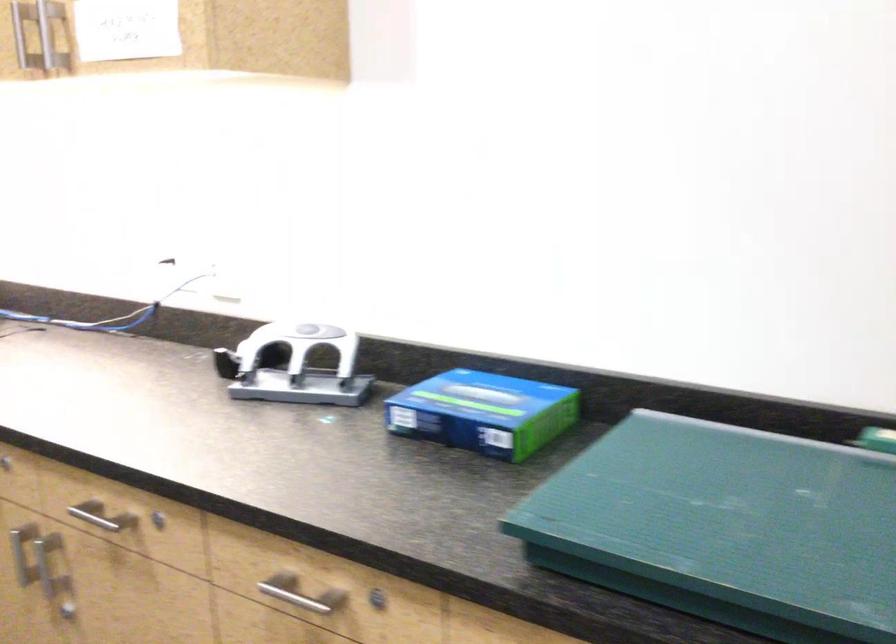
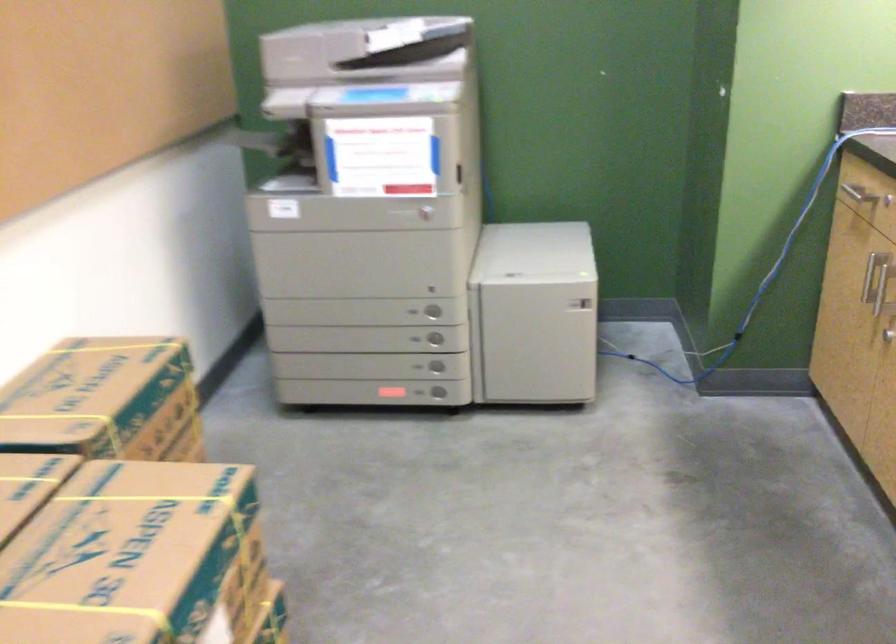
The images are taken continuously from a first-person perspective. In which direction is your viewpoint rotating?

The camera rotated toward left-down.